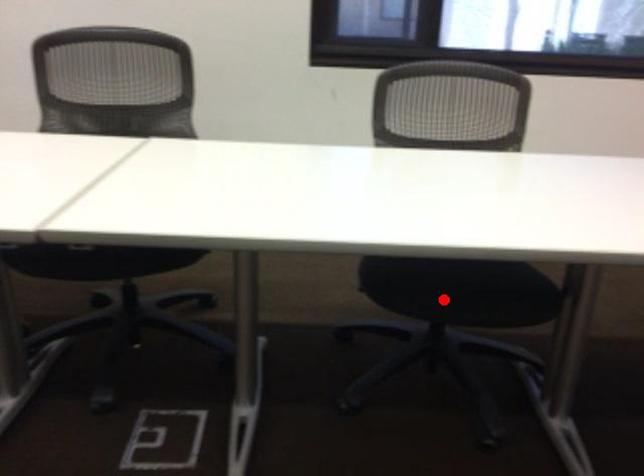
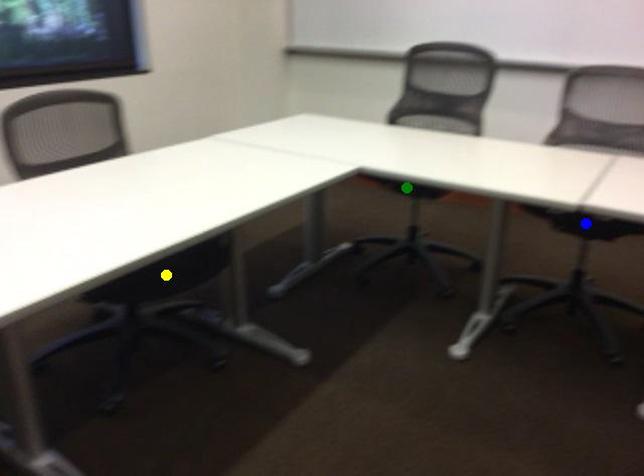
Question: I am providing you with two images of the same scene from different viewpoints. A red point is marked on the first image. You are given multiple points on the second image. In image 2, which mark is for the same physical point as the one in image 1?

Choices:
 (A) yellow point
 (B) green point
 (C) blue point

Answer: (A)